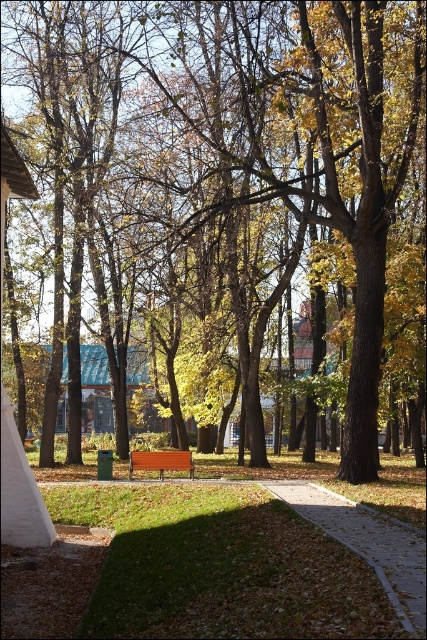
Can you confirm if brown concrete sidewalk at center is positioned to the left of brown wooden bench at center?

In fact, brown concrete sidewalk at center is to the right of brown wooden bench at center.

Who is more distant from viewer, [412,552] or [128,461]?

Point [128,461]

Is point (391, 600) farther from camera compared to point (178, 468)?

No.

Identify the location of brown concrete sidewalk at center. (368, 545).